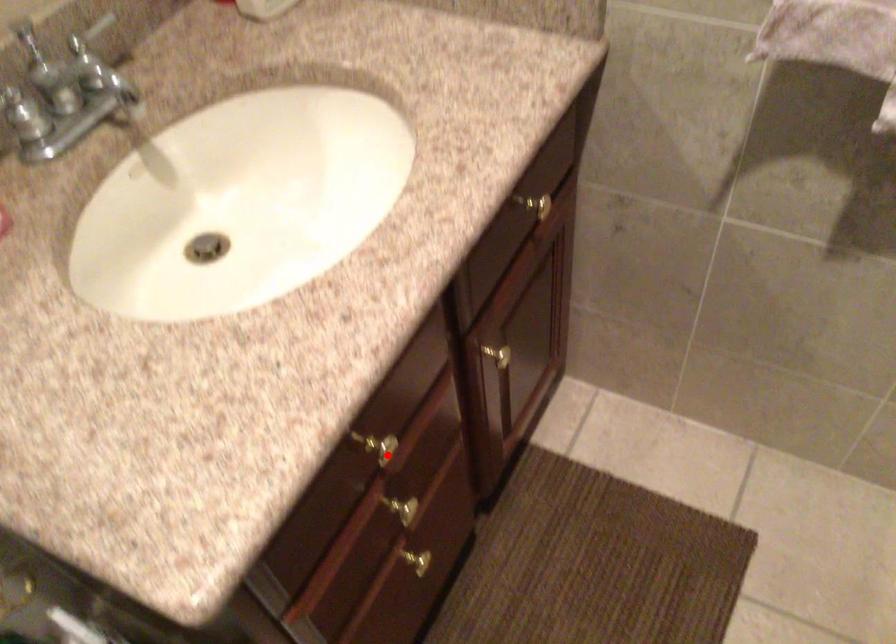
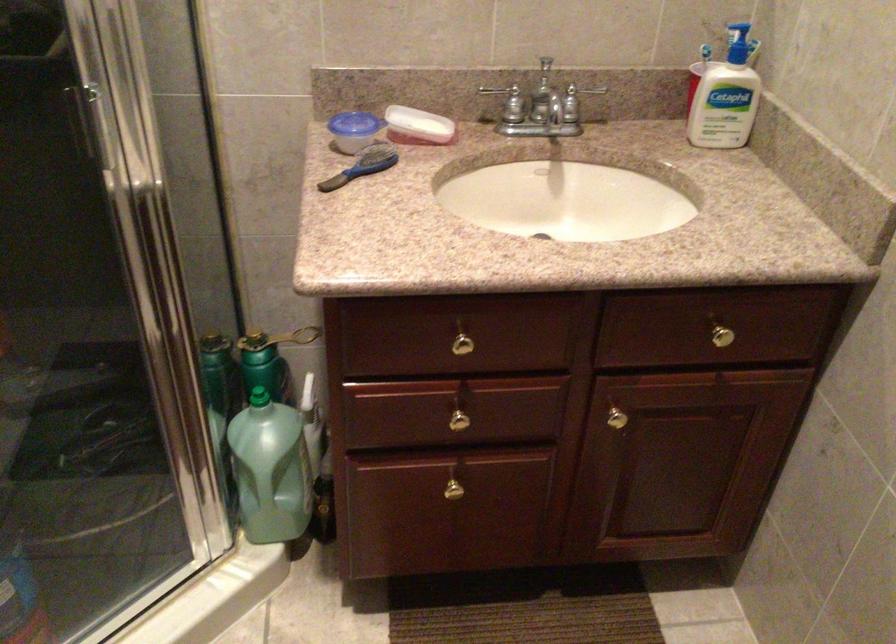
Question: I am providing you with two images of the same scene from different viewpoints. A red point is shown in image1. For the corresponding object point in image2, is it positioned nearer or farther from the camera?

Choices:
 (A) Nearer
 (B) Farther

Answer: (B)